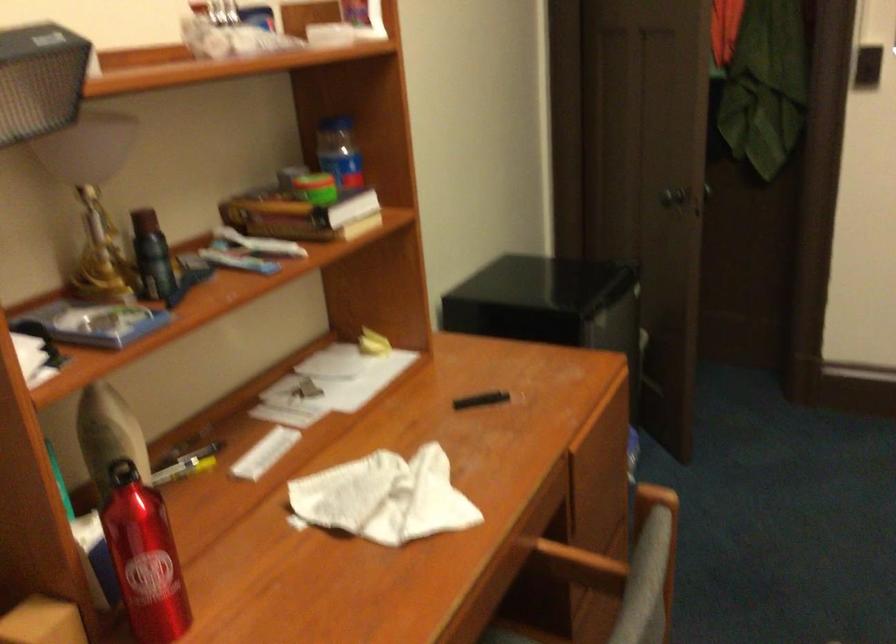
Where would you lift the red water bottle? Please return your answer as a coordinate pair (x, y).

(143, 558)